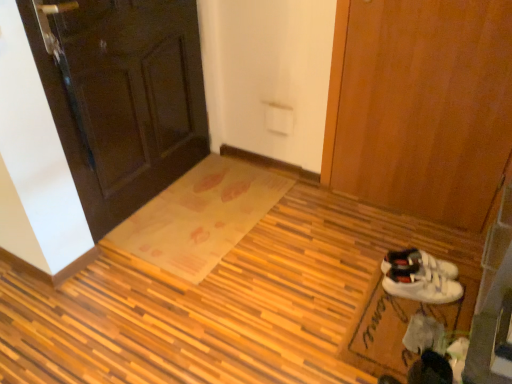
At what (x,y) coordinates should I click in order to perform the action: click on unoccupied area in front of wooden door at right, marked as the first door in a right-to-left arrangement. Please return your answer as a coordinate pair (x, y). The width and height of the screenshot is (512, 384). Looking at the image, I should click on (402, 246).